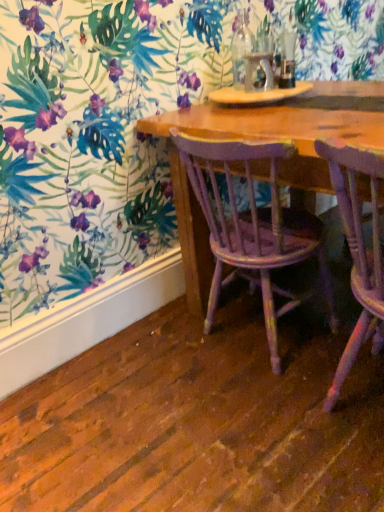
Find the location of a particular element. This screenshot has width=384, height=512. empty space that is ontop of distressed purple wood chair at center, the first chair in the left-to-right sequence is located at coordinates (253, 122).